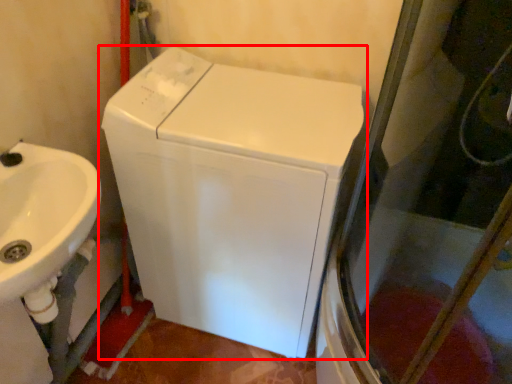
Question: From the image's perspective, where is washing machine (annotated by the red box) located relative to sink?

Choices:
 (A) above
 (B) below

Answer: (A)